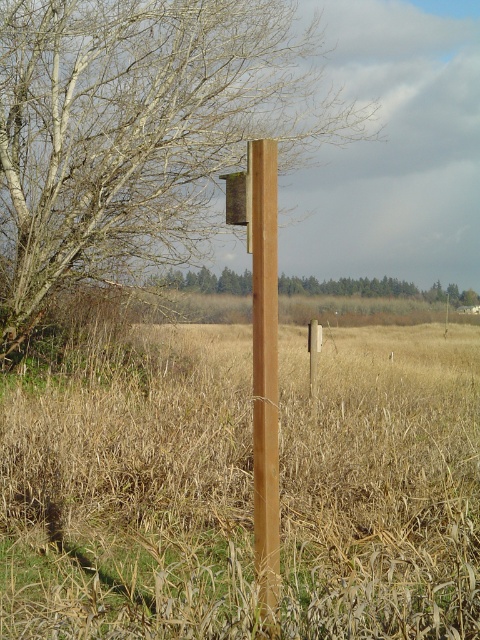
Is brown wood post at center above green matte tree at center?

Yes.

Who is more forward, (130,17) or (373,282)?

Point (130,17)

Where is `brown wood post at center`? The height and width of the screenshot is (640, 480). brown wood post at center is located at coordinates (139, 131).

Does brown wood post at center come behind smooth brown post at center?

That is True.

Looking at this image, does brown wood post at center have a lesser width compared to smooth brown post at center?

No, brown wood post at center is not thinner than smooth brown post at center.

Where is `brown wood post at center`? brown wood post at center is located at coordinates (139, 131).

Who is more forward, (356,513) or (467,304)?

Positioned in front is point (356,513).

Who is lower down, dry grass at center or green matte tree at center?

dry grass at center is below.

The image size is (480, 640). What are the coordinates of `dry grass at center` in the screenshot? It's located at (132, 493).